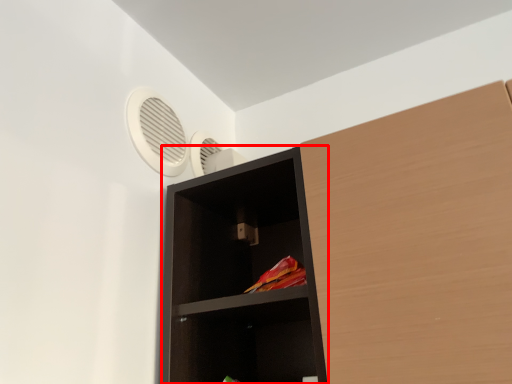
Question: Where is shelf (annotated by the red box) located in relation to fan in the image?

Choices:
 (A) left
 (B) right

Answer: (B)